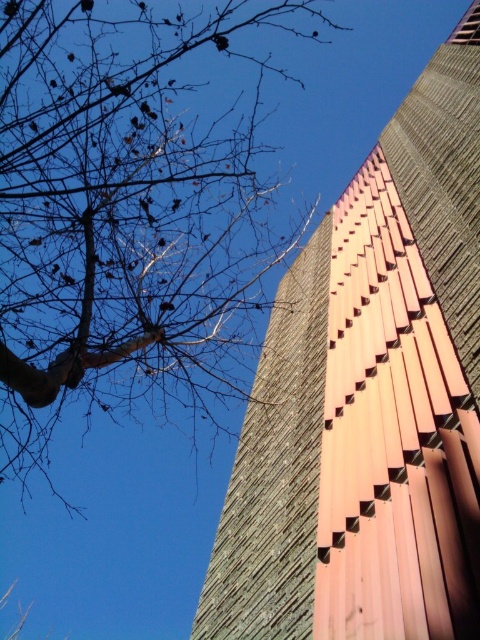
Can you confirm if rustic wood paneling at upper right is positioned below bare branches at upper left?

No, rustic wood paneling at upper right is not below bare branches at upper left.

Can you confirm if rustic wood paneling at upper right is shorter than bare branches at upper left?

Yes.

Where is `rustic wood paneling at upper right`? The image size is (480, 640). rustic wood paneling at upper right is located at coordinates (370, 400).